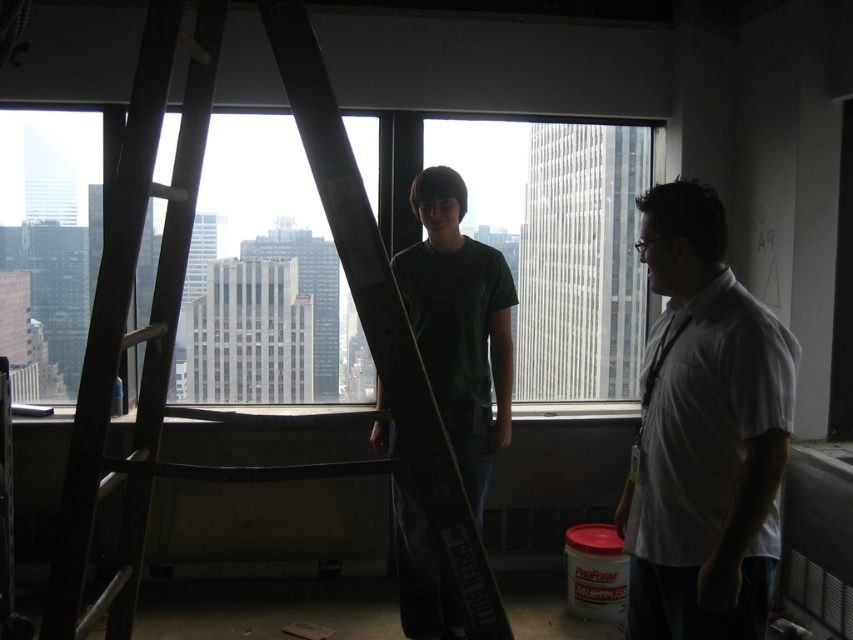
You are standing in the room and want to move from the point at coordinates (650, 150) to the point at coordinates (442, 228). Which direction should you move relative to your current position?

You should move away from the viewer because point (442, 228) is further away than point (650, 150).

You are a delivery person trying to navigate through the room to place a package on the desk. There is a wooden ladder at center and a white shirt at right in the scene. Which object should you avoid to ensure you have enough space to move around?

You should avoid the wooden ladder at center because it might be wider than the white shirt at right, which could block your path more significantly.